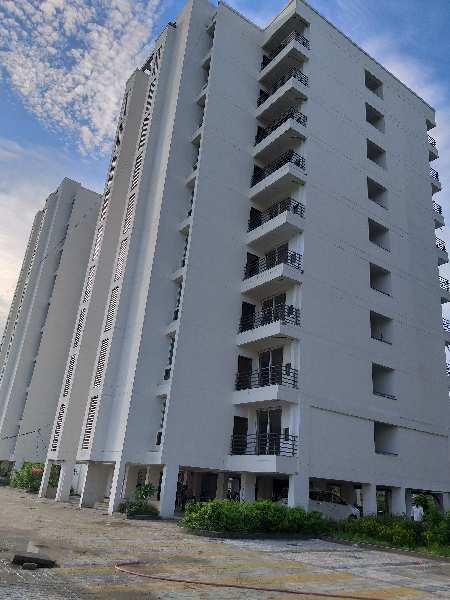
Identify the location of single door adjacent double glass doors. The height and width of the screenshot is (600, 450). (238, 426), (243, 372), (247, 317), (249, 261), (257, 215), (258, 171), (263, 131), (265, 93), (265, 57).